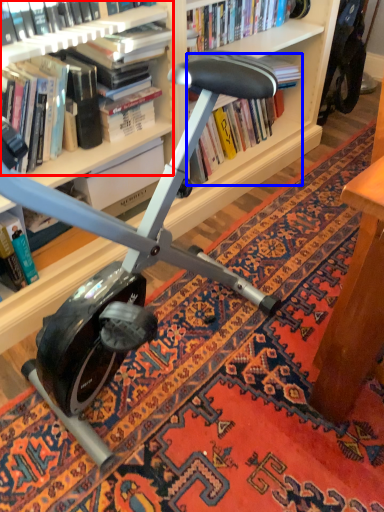
Question: Which point is closer to the camera, book (highlighted by a red box) or book (highlighted by a blue box)?

Choices:
 (A) book
 (B) book

Answer: (A)